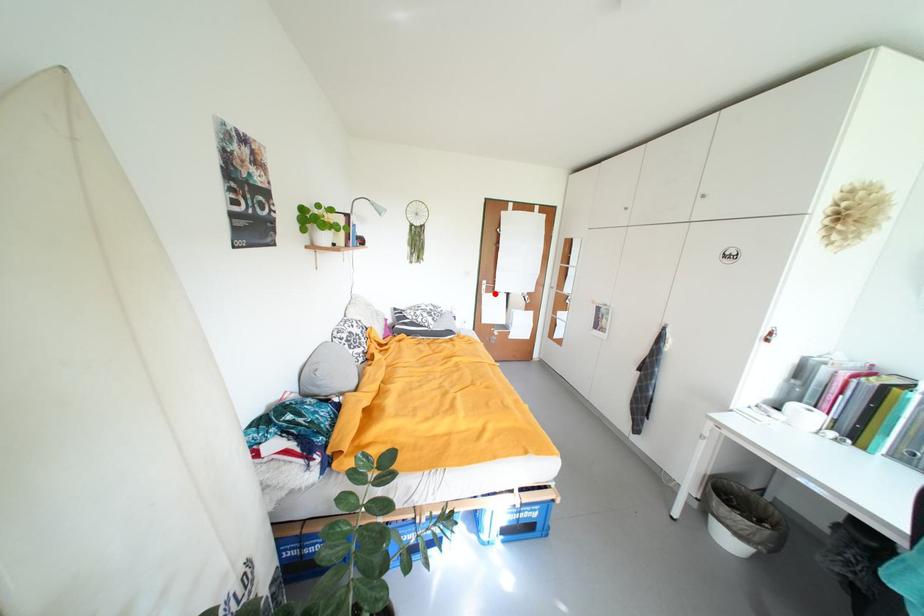
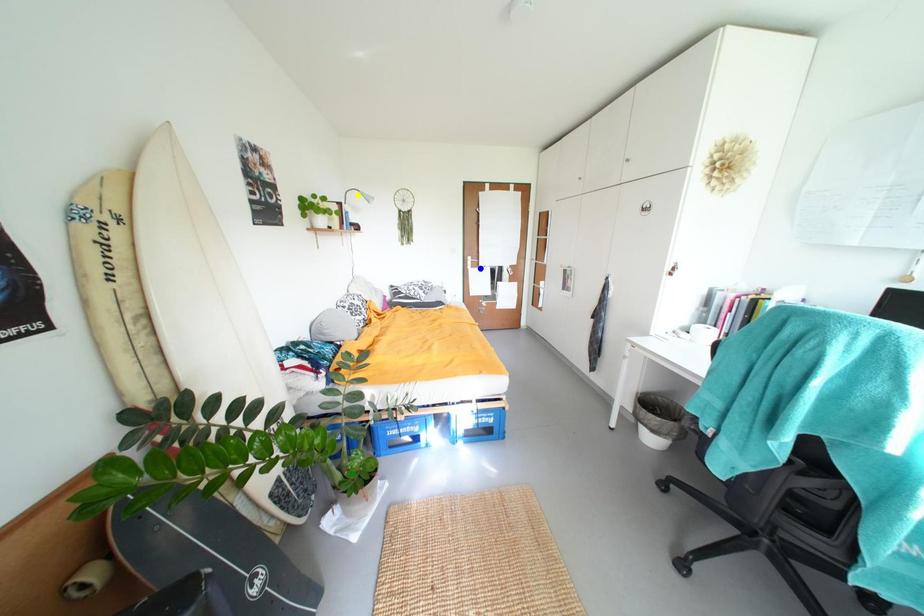
Question: I am providing you with two images of the same scene from different viewpoints. A red point is marked on the first image. You are given multiple points on the second image. Which point in image 2 represents the same 3d spot as the red point in image 1?

Choices:
 (A) blue point
 (B) green point
 (C) yellow point

Answer: (A)